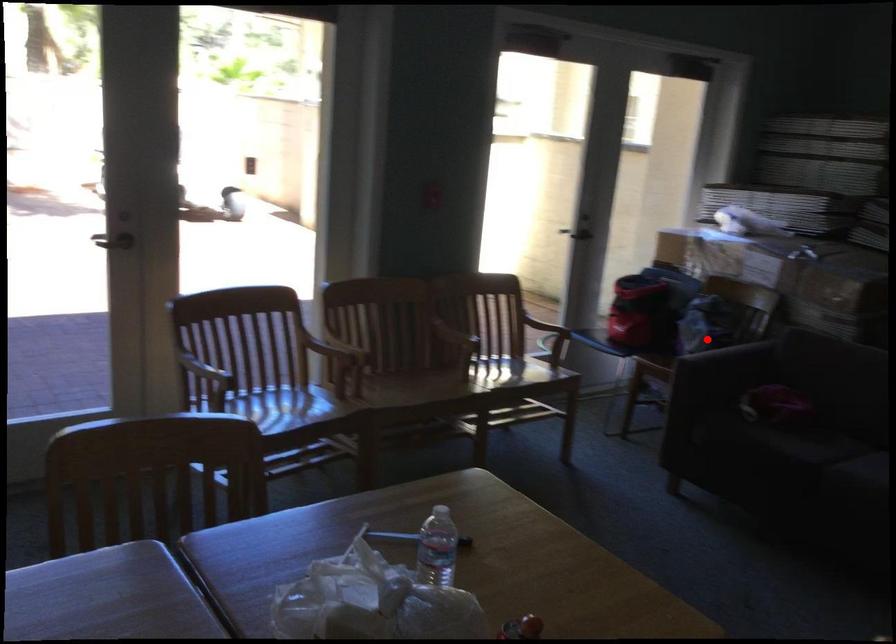
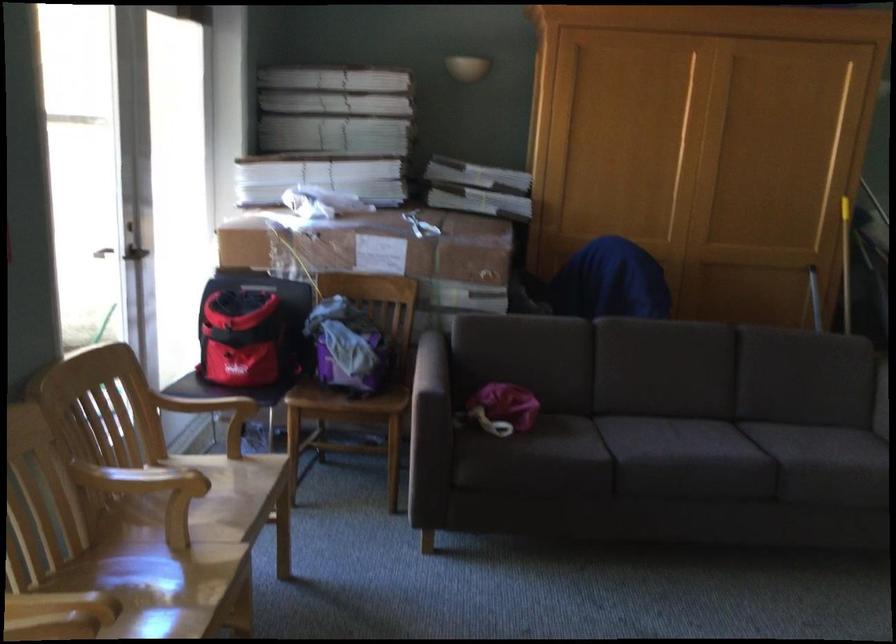
Find the pixel in the second image that matches the highlighted location in the first image.

(352, 366)